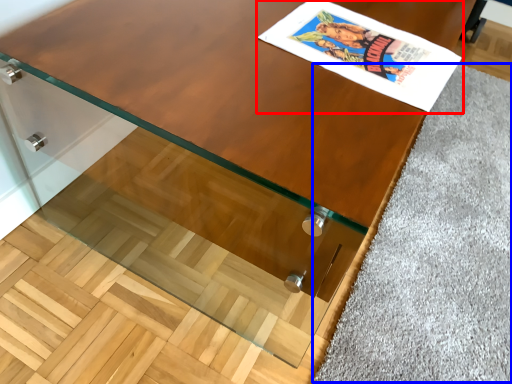
Question: Which of the following is the farthest to the observer, comic book (highlighted by a red box) or gray (highlighted by a blue box)?

Choices:
 (A) comic book
 (B) gray

Answer: (B)